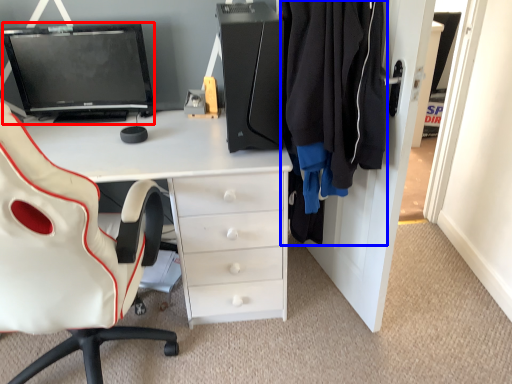
Question: Among these objects, which one is farthest to the camera, computer monitor (highlighted by a red box) or clothing (highlighted by a blue box)?

Choices:
 (A) computer monitor
 (B) clothing

Answer: (A)